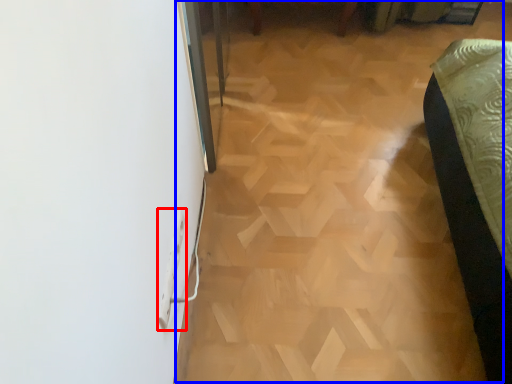
Question: Which point is further to the camera, electric outlet (highlighted by a red box) or plywood (highlighted by a blue box)?

Choices:
 (A) electric outlet
 (B) plywood

Answer: (B)